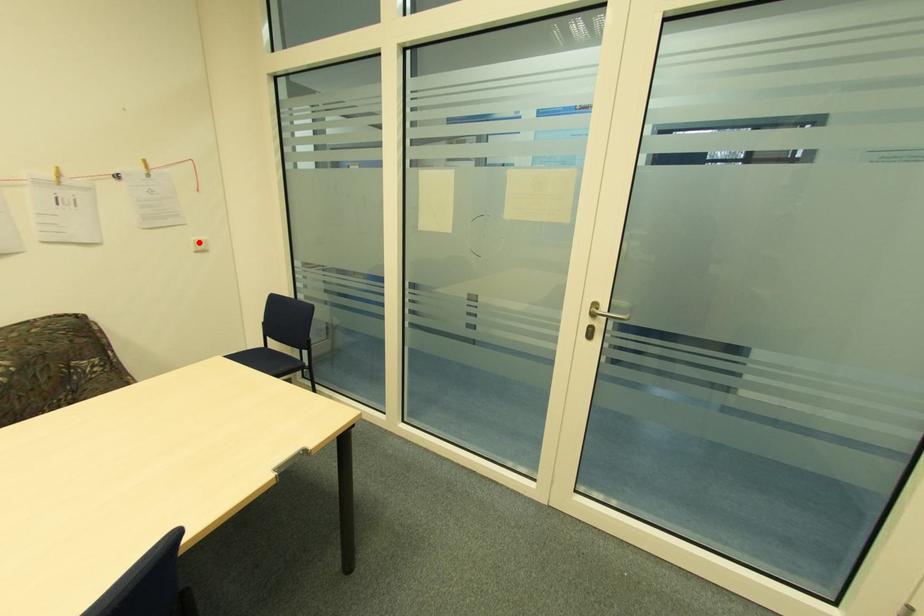
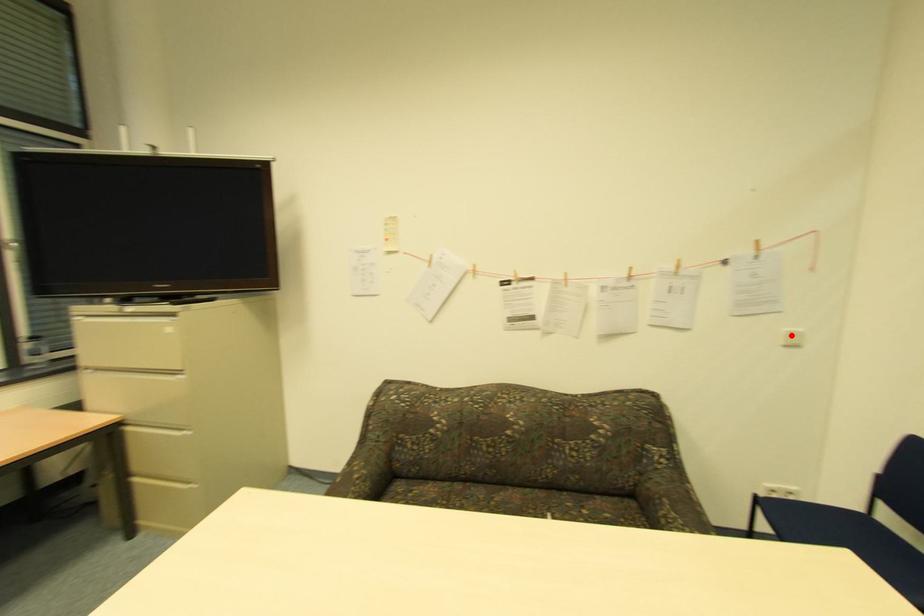
I am providing you with two images of the same scene from different viewpoints. A red point is marked on the first image and another point is marked on the second image. Do the highlighted points in image1 and image2 indicate the same real-world spot?

Yes